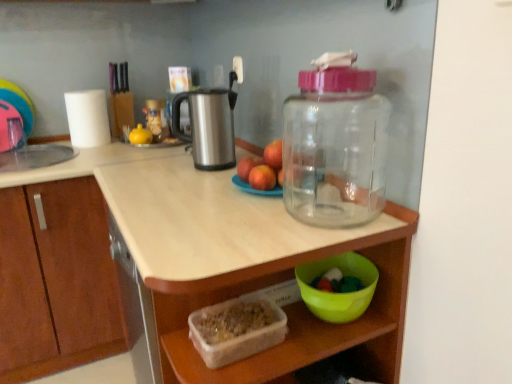
I want to click on free point to the left of transparent plastic bottle at upper right, so click(254, 225).